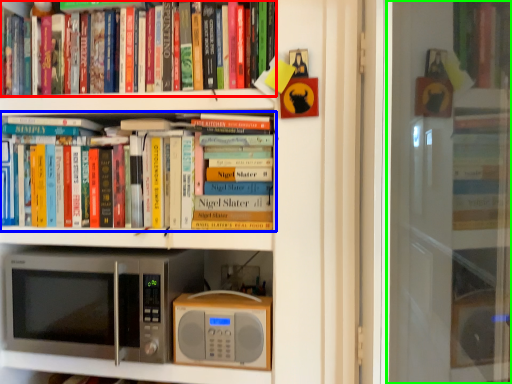
Question: Estimate the real-world distances between objects in this image. Which object is closer to book (highlighted by a red box), book (highlighted by a blue box) or screen door (highlighted by a green box)?

Choices:
 (A) book
 (B) screen door

Answer: (A)